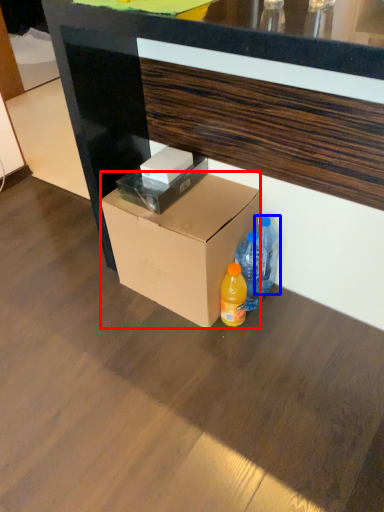
Question: Which of the following is the closest to the observer, box (highlighted by a red box) or bottle (highlighted by a blue box)?

Choices:
 (A) box
 (B) bottle

Answer: (A)